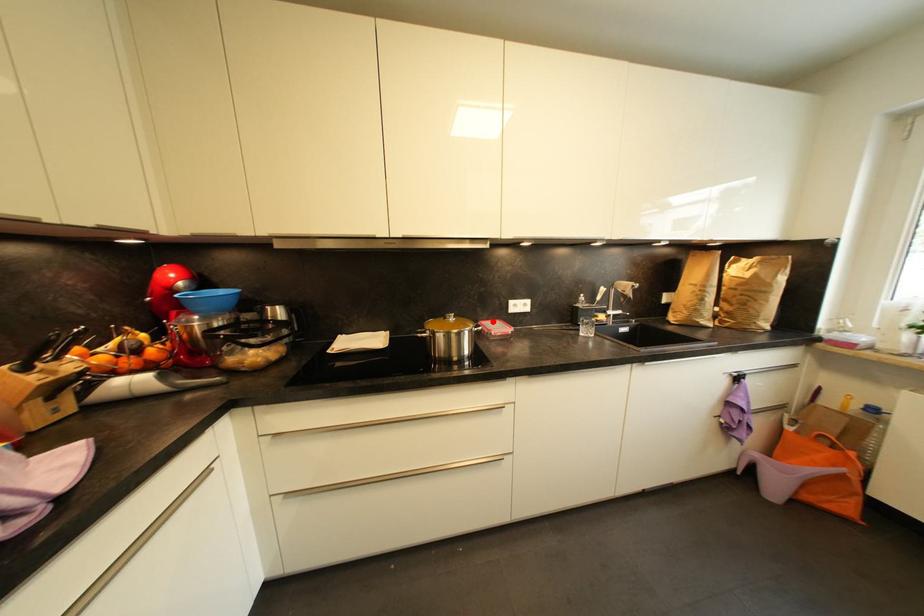
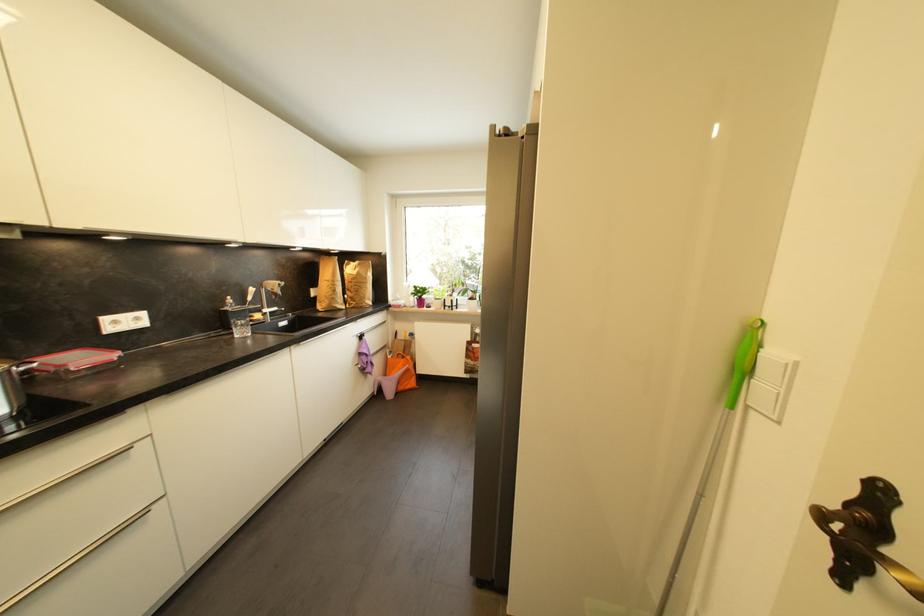
In the second image, find the point that corresponds to the highlighted location in the first image.

(54, 355)